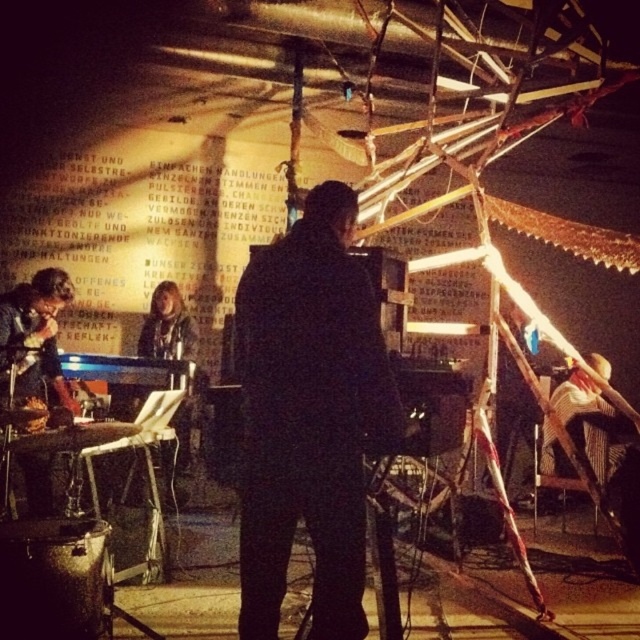
Which is in front, point (296, 374) or point (32, 300)?

Point (296, 374) is in front.

Does point (310, 401) come behind point (28, 392)?

No, (310, 401) is in front of (28, 392).

Which is in front, point (336, 552) or point (19, 330)?

Point (336, 552) is in front.

Locate an element on the screen. Image resolution: width=640 pixels, height=640 pixels. black matte jacket at center is located at coordinates (308, 416).